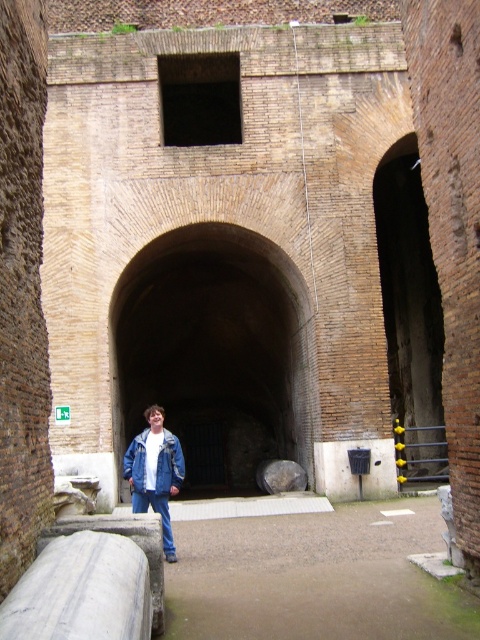
Question: Is brick textured archway at center closer to the viewer compared to blue denim jacket at center?

Choices:
 (A) yes
 (B) no

Answer: (B)

Question: Which of the following is the closest to the observer?

Choices:
 (A) (x=409, y=150)
 (B) (x=309, y=365)

Answer: (B)

Question: Estimate the real-world distances between objects in this image. Which object is farther from the blue denim jacket at center?

Choices:
 (A) brick textured archway at center
 (B) denim jacket at lower left

Answer: (A)

Question: From the image, what is the correct spatial relationship of brick textured archway at center in relation to blue denim jacket at center?

Choices:
 (A) right
 (B) left

Answer: (A)

Question: Which object is farther from the camera taking this photo?

Choices:
 (A) denim jacket at lower left
 (B) brick textured archway at center
 (C) blue denim jacket at center
 (D) brick wall at right

Answer: (B)

Question: Does brick textured archway at center have a lesser width compared to denim jacket at lower left?

Choices:
 (A) no
 (B) yes

Answer: (A)